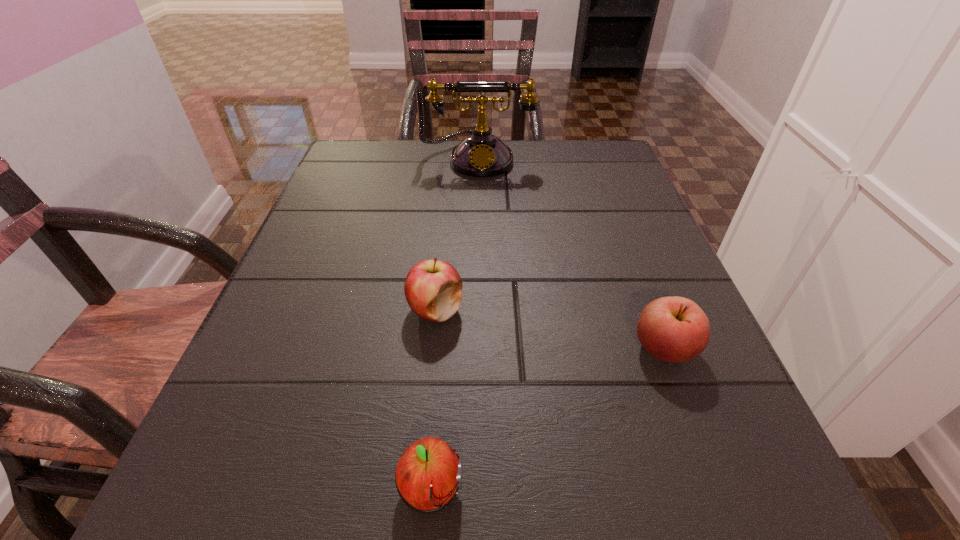
I want to click on the tallest object, so click(x=481, y=154).

The width and height of the screenshot is (960, 540). I want to click on the farthest object, so click(481, 154).

The image size is (960, 540). In order to click on the rightmost apple in this screenshot , I will do `click(674, 329)`.

At what (x,y) coordinates should I click in order to perform the action: click on the nearest object. Please return your answer as a coordinate pair (x, y). The height and width of the screenshot is (540, 960). Looking at the image, I should click on (428, 475).

Find the location of a particular element. The image size is (960, 540). vacant space located 0.250m on the dial of the telephone is located at coordinates (477, 247).

Find the location of a particular element. free region located 0.330m on the back of the rightmost apple is located at coordinates (610, 206).

The width and height of the screenshot is (960, 540). What are the coordinates of `vacant space located on the back of the nearest apple` in the screenshot? It's located at (450, 248).

You are a GUI agent. You are given a task and a screenshot of the screen. Output one action in this format:
    pyautogui.click(x=<x>, y=<y>)
    Task: Click on the object located at the far edge
    Image resolution: width=960 pixels, height=540 pixels.
    Given the screenshot: What is the action you would take?
    pyautogui.click(x=481, y=154)

The height and width of the screenshot is (540, 960). I want to click on object present at the near edge, so pyautogui.click(x=428, y=475).

Locate an element on the screen. The width and height of the screenshot is (960, 540). object that is at the right edge is located at coordinates (674, 329).